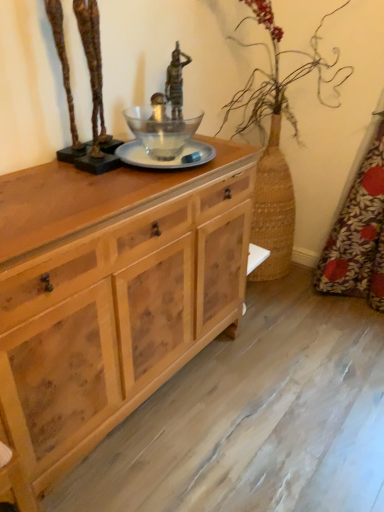
Question: Considering the relative positions of floral fabric at right and natural wood cabinet at center in the image provided, is floral fabric at right to the left of natural wood cabinet at center from the viewer's perspective?

Choices:
 (A) no
 (B) yes

Answer: (A)

Question: Is the position of floral fabric at right less distant than that of natural wood cabinet at center?

Choices:
 (A) no
 (B) yes

Answer: (A)

Question: From a real-world perspective, is floral fabric at right physically above natural wood cabinet at center?

Choices:
 (A) no
 (B) yes

Answer: (B)

Question: Can you confirm if floral fabric at right is shorter than natural wood cabinet at center?

Choices:
 (A) yes
 (B) no

Answer: (B)

Question: Is floral fabric at right bigger than natural wood cabinet at center?

Choices:
 (A) yes
 (B) no

Answer: (B)

Question: From the image's perspective, is bronze sculpture at upper left positioned above or below natural wood cabinet at center?

Choices:
 (A) below
 (B) above

Answer: (B)

Question: Relative to natural wood cabinet at center, is bronze sculpture at upper left in front or behind?

Choices:
 (A) front
 (B) behind

Answer: (B)

Question: Considering the relative positions of bronze sculpture at upper left and natural wood cabinet at center in the image provided, is bronze sculpture at upper left to the left or to the right of natural wood cabinet at center?

Choices:
 (A) right
 (B) left

Answer: (B)

Question: From a real-world perspective, is bronze sculpture at upper left positioned above or below natural wood cabinet at center?

Choices:
 (A) above
 (B) below

Answer: (A)

Question: Would you say floral fabric at right is inside or outside bronze statue at center?

Choices:
 (A) outside
 (B) inside

Answer: (A)

Question: Considering the relative positions of floral fabric at right and bronze statue at center in the image provided, is floral fabric at right to the left or to the right of bronze statue at center?

Choices:
 (A) left
 (B) right

Answer: (B)

Question: In terms of height, does floral fabric at right look taller or shorter compared to bronze statue at center?

Choices:
 (A) short
 (B) tall

Answer: (B)

Question: From a real-world perspective, is floral fabric at right physically located above or below bronze statue at center?

Choices:
 (A) below
 (B) above

Answer: (A)

Question: From the image's perspective, relative to bronze statue at center, is bronze sculpture at upper left above or below?

Choices:
 (A) above
 (B) below

Answer: (B)

Question: Is point (79, 13) closer or farther from the camera than point (173, 106)?

Choices:
 (A) farther
 (B) closer

Answer: (B)